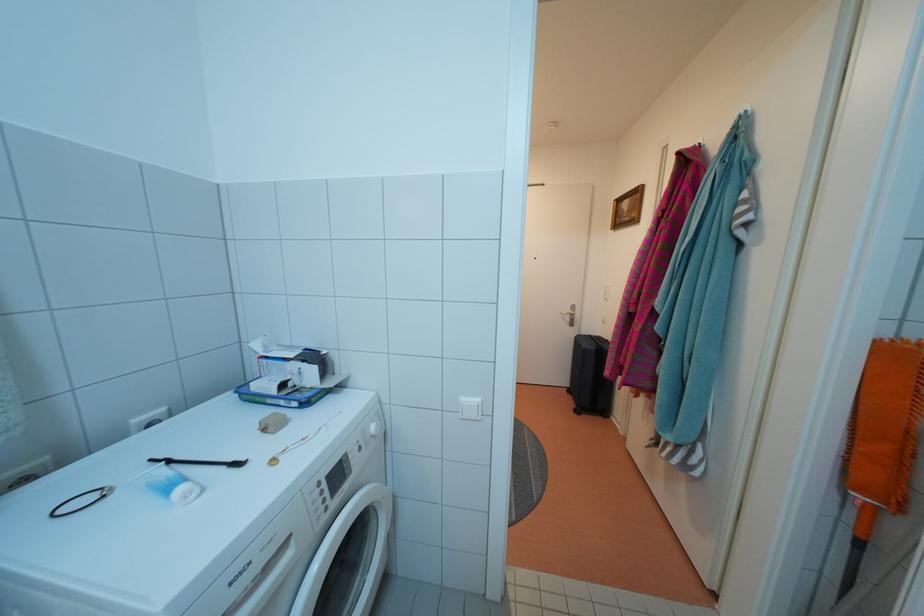
The image size is (924, 616). What do you see at coordinates (590, 376) in the screenshot? I see `the black suitcase` at bounding box center [590, 376].